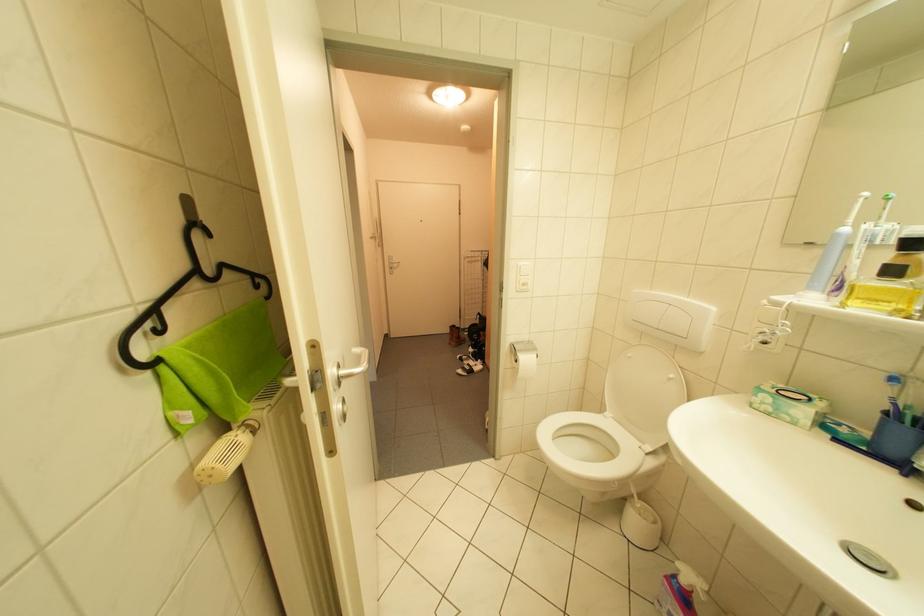
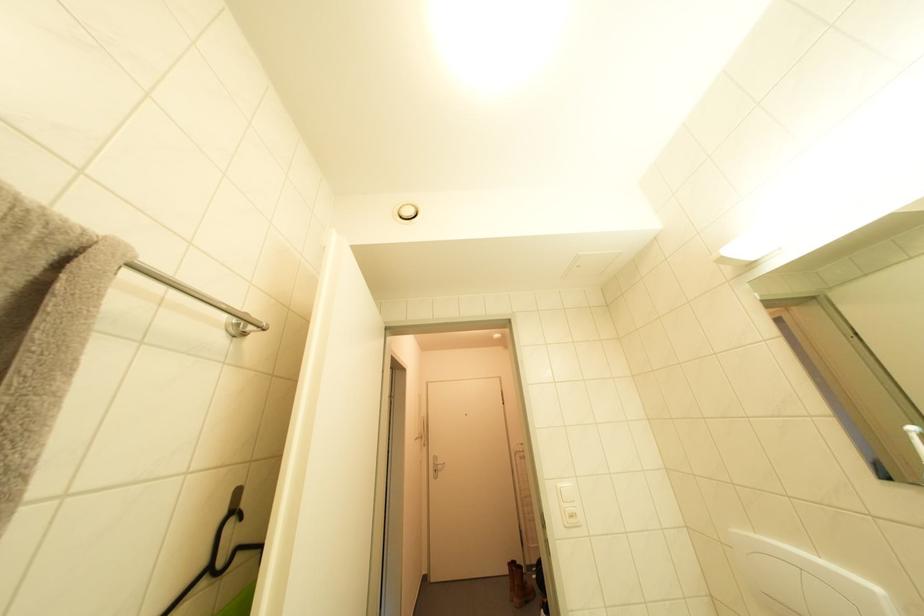
Question: The images are taken continuously from a first-person perspective. In which direction is your viewpoint rotating?

Choices:
 (A) Left
 (B) Right
 (C) Up
 (D) Down

Answer: (C)